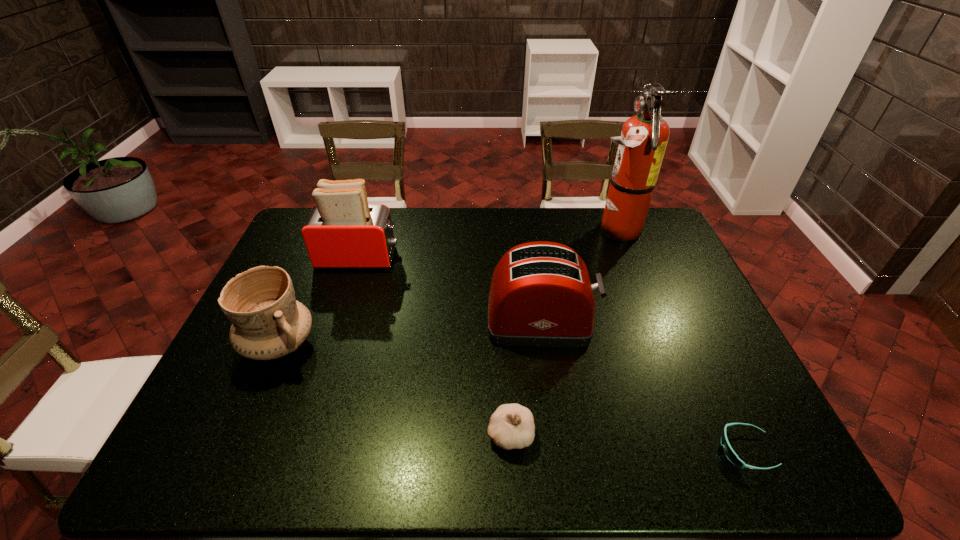
Locate an element on the screen. The width and height of the screenshot is (960, 540). vacant space at the near edge of the desktop is located at coordinates (484, 449).

Where is `free region at the left edge`? This screenshot has width=960, height=540. free region at the left edge is located at coordinates (259, 422).

Image resolution: width=960 pixels, height=540 pixels. Identify the location of vacant space at the right edge of the desktop. (705, 309).

In the image, there is a desktop. At what (x,y) coordinates should I click in order to perform the action: click on free region at the far right corner. Please return your answer as a coordinate pair (x, y). This screenshot has height=540, width=960. Looking at the image, I should click on (652, 227).

Where is `vacant point located between the garlic and the fifth shortest object`? Image resolution: width=960 pixels, height=540 pixels. vacant point located between the garlic and the fifth shortest object is located at coordinates (435, 346).

This screenshot has height=540, width=960. Find the location of `vacant area that lies between the second shortest object and the nearer toaster`. vacant area that lies between the second shortest object and the nearer toaster is located at coordinates (525, 377).

Where is `vacant space that's between the pottery and the fire extinguisher`? The height and width of the screenshot is (540, 960). vacant space that's between the pottery and the fire extinguisher is located at coordinates (446, 287).

In order to click on free spot between the tallest object and the second tallest object in this screenshot , I will do `click(487, 244)`.

This screenshot has width=960, height=540. In order to click on vacant space in between the shortest object and the shorter toaster in this screenshot , I will do `click(643, 386)`.

I want to click on vacant space in between the pottery and the fire extinguisher, so click(446, 287).